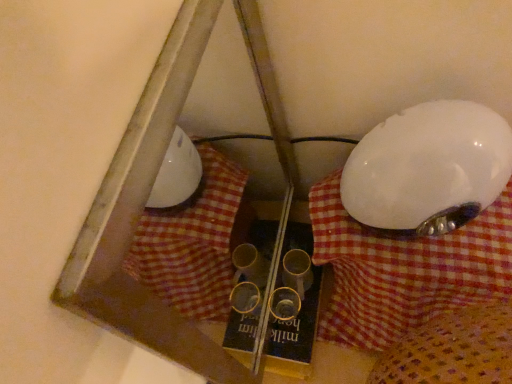
Where is `free point above white checkered fabric at center (from a real-world perspective)`? free point above white checkered fabric at center (from a real-world perspective) is located at coordinates (447, 251).